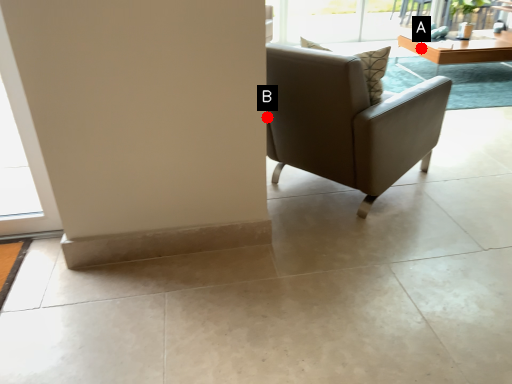
Question: Two points are circled on the image, labeled by A and B beside each circle. Among these points, which one is farthest from the camera?

Choices:
 (A) A is further
 (B) B is further

Answer: (A)